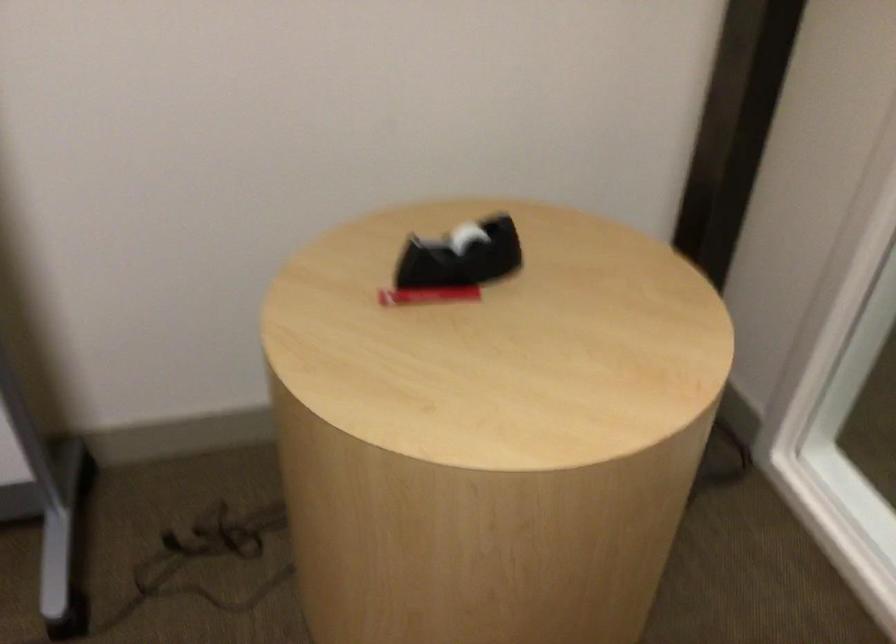
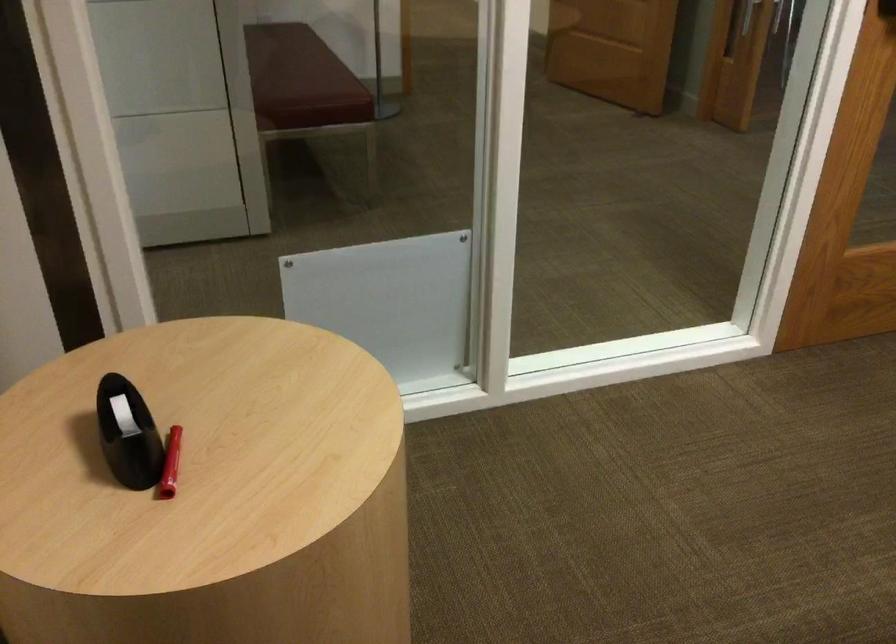
Find the pixel in the second image that matches [418,290] in the first image.

(170, 464)